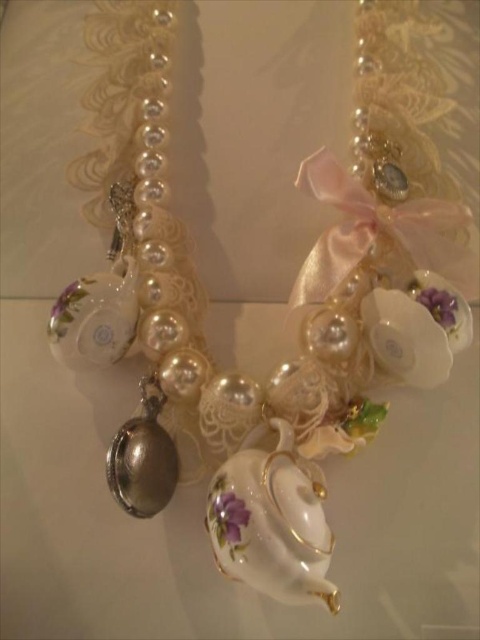
You are an artisan creating a necklace and want to ensure the purple glossy flower at center and the purple porcelain flower at center are balanced. Given their sizes, which flower should be placed closer to the center of the necklace to maintain symmetry?

The purple glossy flower at center is larger in size than the purple porcelain flower at center, so to maintain symmetry, the larger purple glossy flower at center should be placed closer to the center of the necklace while the smaller purple porcelain flower at center can be positioned slightly outward.

Looking at this image, you are an interior designer who wants to display the necklace arrangement on a wall. The wall has a 3.5 feet wide space available. Can the porcelain teapot at center be placed within this space if it is positioned exactly at the center of the available space?

The porcelain teapot at center is 3.40 feet away from the viewer, so it can be placed within the 3.5 feet wide space as it is slightly narrower than the available width.